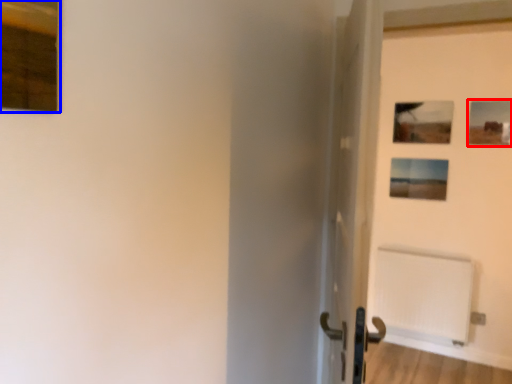
Question: Which object appears closest to the camera in this image, picture frame (highlighted by a red box) or picture frame (highlighted by a blue box)?

Choices:
 (A) picture frame
 (B) picture frame

Answer: (B)